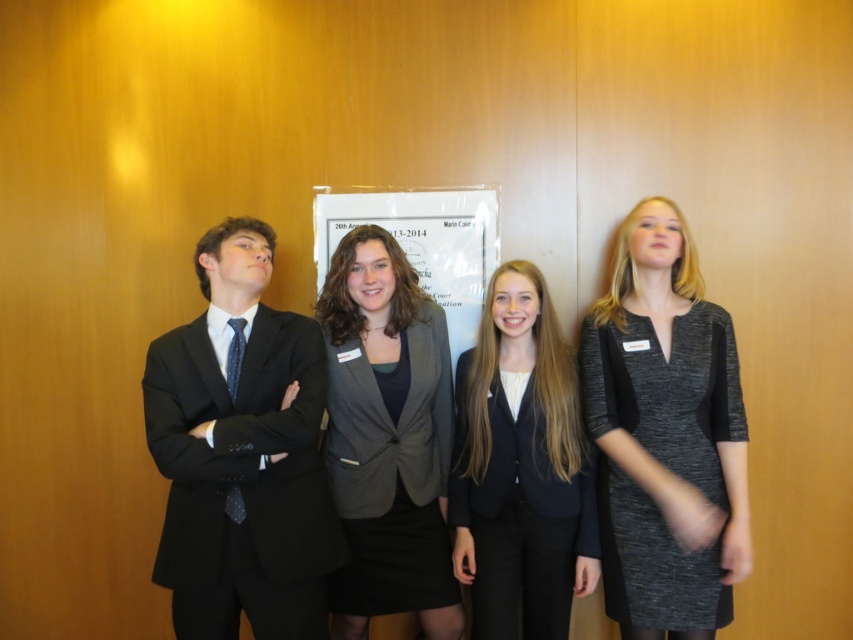
Between matte black suit at left and black matte blazer at center, which one has less height?

With less height is black matte blazer at center.

Between point (242, 444) and point (474, 570), which one is positioned behind?

Positioned behind is point (474, 570).

At what (x,y) coordinates should I click in order to perform the action: click on matte black suit at left. Please return your answer as a coordinate pair (x, y). Looking at the image, I should click on (241, 452).

Based on the photo, is black textured dress at center bigger than black matte blazer at center?

Yes, black textured dress at center is bigger than black matte blazer at center.

Is black textured dress at center shorter than black matte blazer at center?

Incorrect, black textured dress at center's height does not fall short of black matte blazer at center's.

Measure the distance between black textured dress at center and camera.

They are 1.96 meters apart.

Locate an element on the screen. This screenshot has width=853, height=640. black textured dress at center is located at coordinates (x=665, y=435).

Can you confirm if black textured dress at center is positioned above matte gray blazer at center?

Correct, black textured dress at center is located above matte gray blazer at center.

Image resolution: width=853 pixels, height=640 pixels. Identify the location of black textured dress at center. (665, 435).